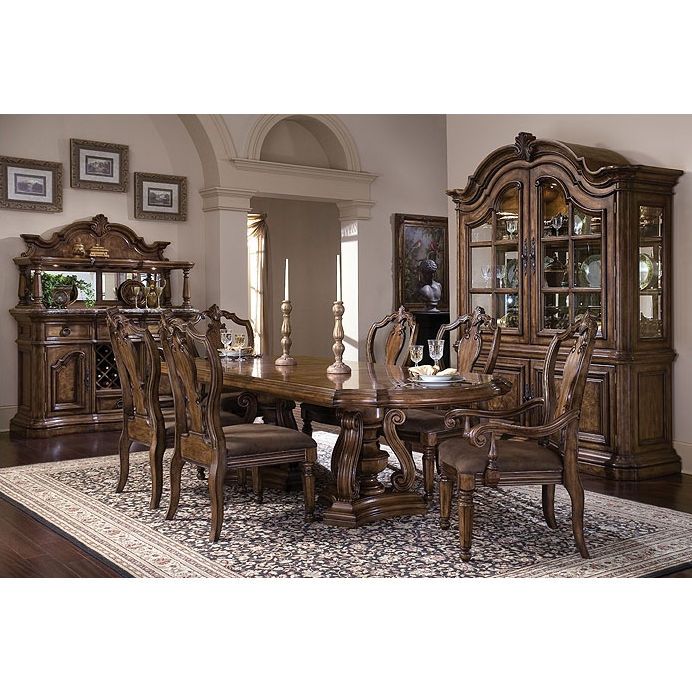
I want to click on artwork, so click(34, 183), click(106, 156), click(163, 192), click(426, 235).